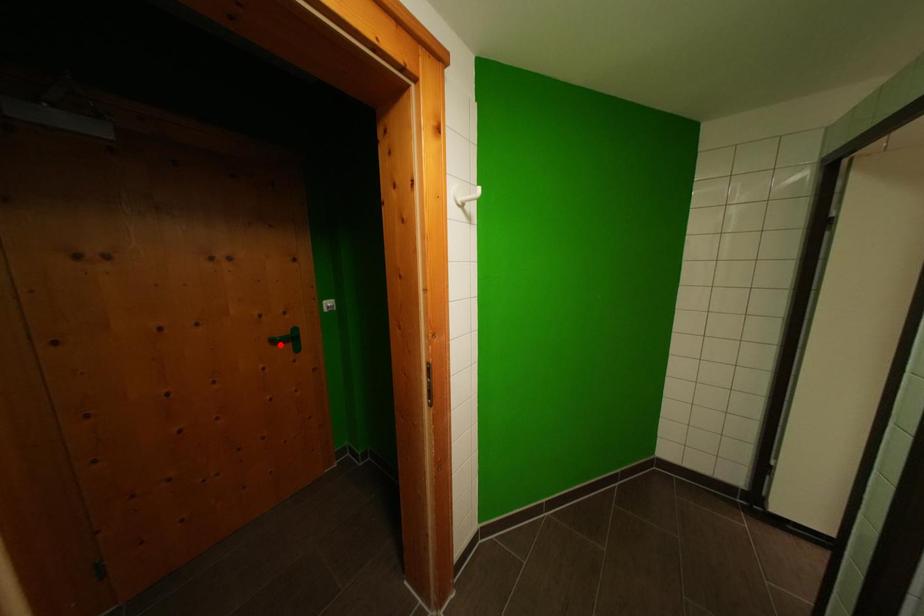
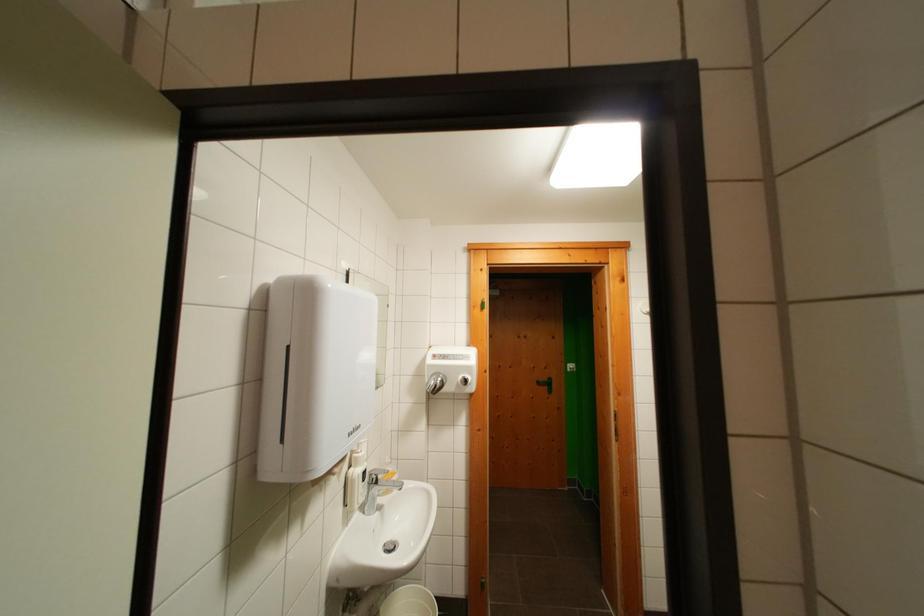
Question: I am providing you with two images of the same scene from different viewpoints. Image1 has a red point marked. In image2, the corresponding 3D location appears at what relative position? Reply with the corresponding letter.

Choices:
 (A) Closer
 (B) Farther

Answer: (B)